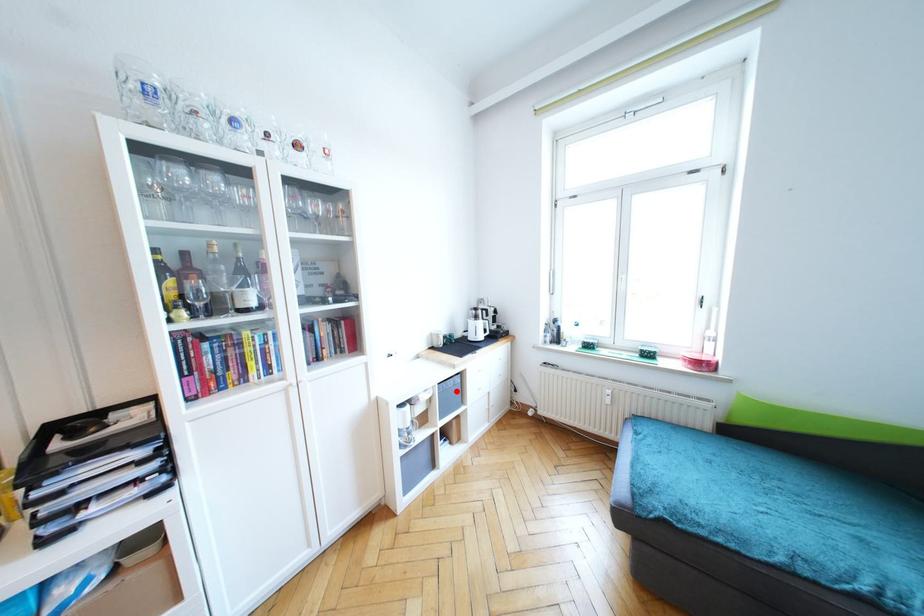
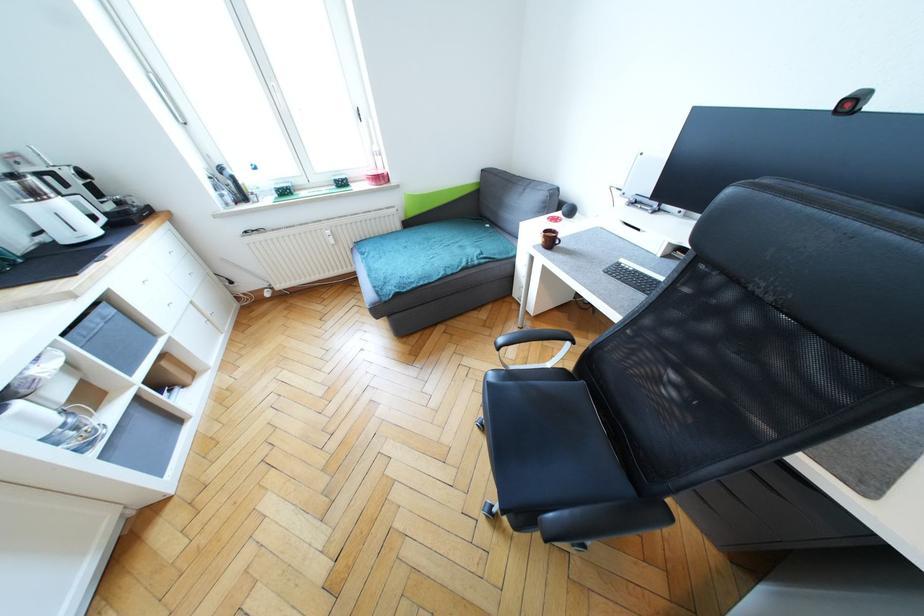
The point at the highlighted location is marked in the first image. Where is the corresponding point in the second image?

(116, 329)